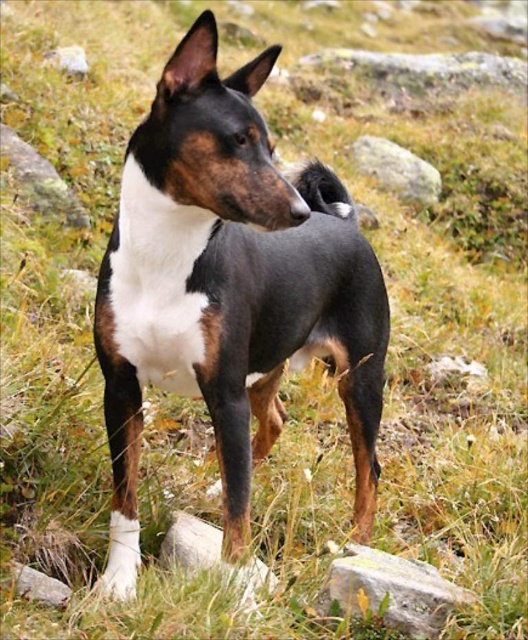
You are a hiker trying to navigate through the rocky terrain. You see the gray rock at upper center and the gray rock at lower left. Which rock is higher up in the image?

The gray rock at upper center is positioned over the gray rock at lower left, so it is higher up in the image.

Based on the photo, you are a hiker who wants to place a small backpack on the ground between the gray rough rock at lower center and the gray rock at lower left. Based on their positions, where exactly should you place it?

You should place the backpack between the gray rough rock at lower center and the gray rock at lower left, but closer to the gray rock at lower left since the gray rough rock at lower center is located below it.

You are a photographer setting up a camera to capture the black glossy dog at center and the gray rough rock at lower center. The camera has a fixed width of 2 meters. Can the camera frame both subjects without cropping either of them if they are positioned side by side?

The black glossy dog at center might be wider than gray rough rock at lower center, so it is uncertain if the camera with a 2 meter width can frame both without cropping. Check their actual widths first.